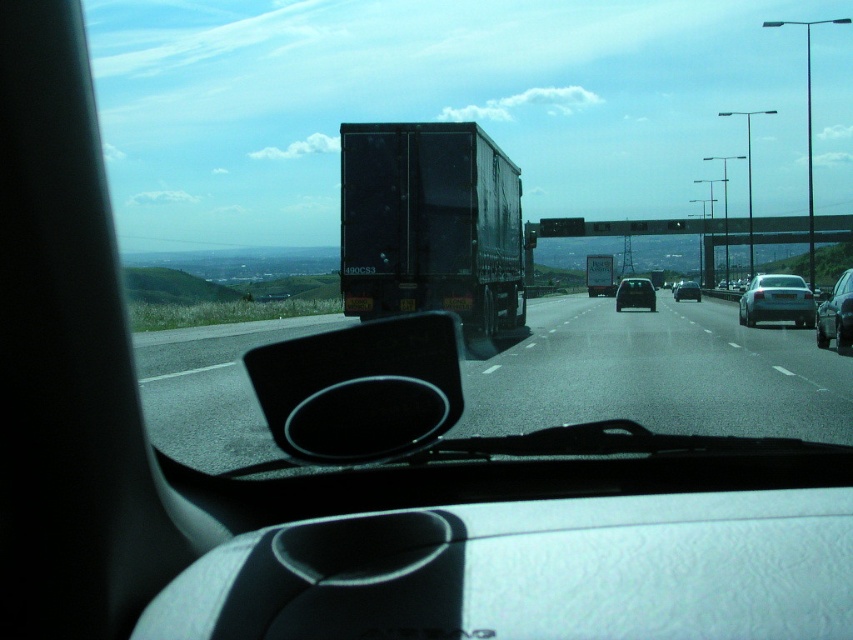
You are driving a car that is 5 meters long. You see a silver metallic sedan at right and a shiny silver sedan at center. Can your car fit between them without touching either?

The distance between the silver metallic sedan at right and the shiny silver sedan at center is 28.57 meters. Since your car is only 5 meters long, there is enough space to fit your car between them without touching either vehicle.